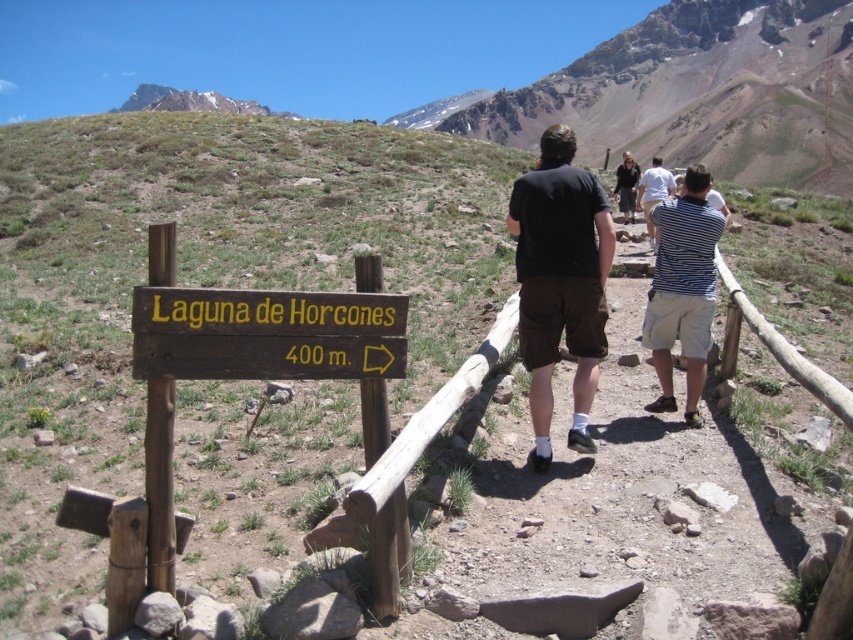
Question: Which object is the farthest from the black cotton shirt at center?

Choices:
 (A) striped shirt at upper right
 (B) brown wooden sign at lower left
 (C) striped cotton shirt at right
 (D) white snow-covered mountain at upper center

Answer: (D)

Question: Is striped cotton shirt at right positioned at the back of striped shirt at upper right?

Choices:
 (A) no
 (B) yes

Answer: (A)

Question: Among these points, which one is farthest from the camera?

Choices:
 (A) click(674, 404)
 (B) click(430, 104)

Answer: (B)

Question: Which point appears farthest from the camera in this image?

Choices:
 (A) (650, 301)
 (B) (640, 200)
 (C) (142, 339)

Answer: (B)

Question: Can you confirm if black cotton shirt at center is positioned below striped cotton shirt at right?

Choices:
 (A) yes
 (B) no

Answer: (B)

Question: Can you confirm if black cotton shirt at center is positioned above white snow-covered mountain at upper center?

Choices:
 (A) no
 (B) yes

Answer: (A)